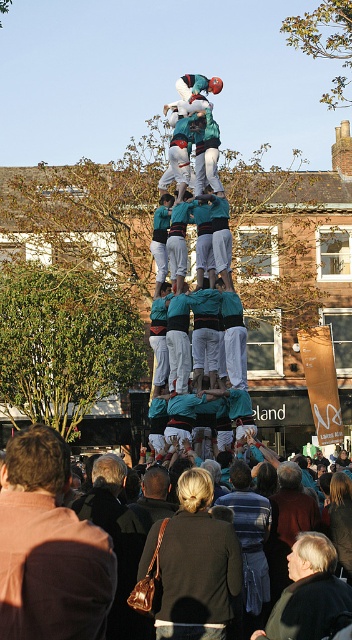
Is dark brown leather jacket at lower center taller than dark blue jacket at center?

Yes, dark brown leather jacket at lower center is taller than dark blue jacket at center.

Consider the image. Who is positioned more to the right, dark brown leather jacket at lower center or dark blue jacket at center?

dark blue jacket at center is more to the right.

Who is more forward, [39,554] or [236,508]?

Positioned in front is point [39,554].

You are a GUI agent. You are given a task and a screenshot of the screen. Output one action in this format:
    pyautogui.click(x=<x>, y=<y>)
    Task: Click on the dark brown leather jacket at lower center
    
    Given the screenshot: What is the action you would take?
    pyautogui.click(x=49, y=548)

Is dark brown leather jacket at lower center above dark gray jacket at center?

Yes, dark brown leather jacket at lower center is above dark gray jacket at center.

Which is above, dark brown leather jacket at lower center or dark gray jacket at center?

Positioned higher is dark brown leather jacket at lower center.

The height and width of the screenshot is (640, 352). I want to click on dark brown leather jacket at lower center, so click(49, 548).

This screenshot has width=352, height=640. In order to click on dark brown leather jacket at lower center in this screenshot , I will do `click(49, 548)`.

From the picture: Between brown leather jacket at lower left and dark gray jacket at center, which one is positioned higher?

brown leather jacket at lower left is above.

Is point (89, 548) closer to camera compared to point (321, 538)?

Yes, it is in front of point (321, 538).

Is point (7, 577) closer to camera compared to point (325, 600)?

Yes, it is in front of point (325, 600).

Identify the location of brown leather jacket at lower left. The width and height of the screenshot is (352, 640). (48, 548).